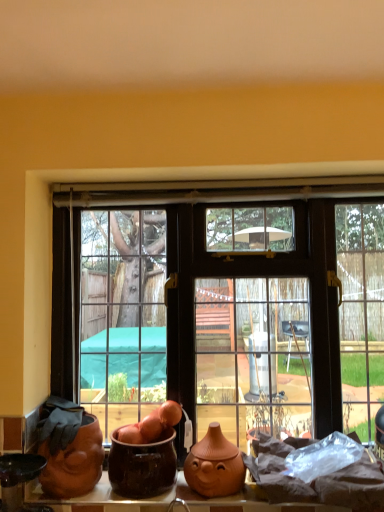
Question: Relative to brown glazed pot at center, positioned as the 2th pottery in left-to-right order, is matte orange clay vase at center, the third pottery when ordered from left to right, in front or behind?

Choices:
 (A) behind
 (B) front

Answer: (A)

Question: Considering the positions of matte orange clay vase at center, which appears as the 1th pottery when viewed from the right, and brown glazed pot at center, the 2th pottery when ordered from right to left, in the image, is matte orange clay vase at center, which appears as the 1th pottery when viewed from the right, wider or thinner than brown glazed pot at center, the 2th pottery when ordered from right to left,?

Choices:
 (A) wide
 (B) thin

Answer: (B)

Question: Which object is positioned farthest from the brown glazed pot at center, positioned as the 2th pottery in left-to-right order?

Choices:
 (A) matte orange clay vase at center, which appears as the 1th pottery when viewed from the right
 (B) matte terracotta pot at lower left, which appears as the 1th pottery when viewed from the left
 (C) matte glass window at center

Answer: (C)

Question: Based on their relative distances, which object is farther from the matte orange clay vase at center, which appears as the 1th pottery when viewed from the right?

Choices:
 (A) matte glass window at center
 (B) brown glazed pot at center, the 2th pottery when ordered from right to left
 (C) matte terracotta pot at lower left, which appears as the 1th pottery when viewed from the left

Answer: (A)